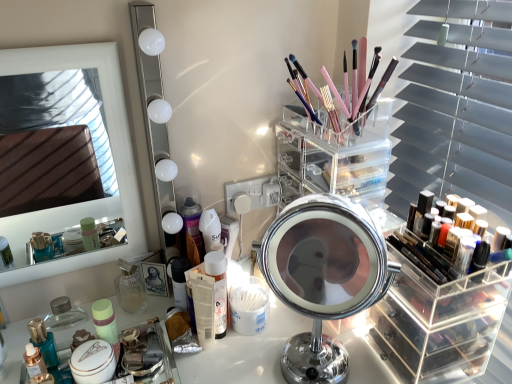
Question: Is clear acrylic organizer at center, acting as the 2th shelf starting from the bottom, in front of shiny metallic perfume at lower left, the 1th toiletry viewed from the left?

Choices:
 (A) yes
 (B) no

Answer: (A)

Question: Is clear acrylic organizer at center, marked as the 2th shelf in a right-to-left arrangement, at the left side of shiny metallic perfume at lower left, the 4th toiletry viewed from the right?

Choices:
 (A) no
 (B) yes

Answer: (A)

Question: From a real-world perspective, does clear acrylic organizer at center, acting as the 2th shelf starting from the bottom, stand above shiny metallic perfume at lower left, the 4th toiletry viewed from the right?

Choices:
 (A) no
 (B) yes

Answer: (B)

Question: Can shiny metallic perfume at lower left, the 4th toiletry viewed from the right, be found inside clear acrylic organizer at center, positioned as the 1th shelf in left-to-right order?

Choices:
 (A) no
 (B) yes

Answer: (A)

Question: Considering the relative sizes of clear acrylic organizer at center, positioned as the 1th shelf in left-to-right order, and shiny metallic perfume at lower left, the 4th toiletry viewed from the right, in the image provided, is clear acrylic organizer at center, positioned as the 1th shelf in left-to-right order, taller than shiny metallic perfume at lower left, the 4th toiletry viewed from the right,?

Choices:
 (A) yes
 (B) no

Answer: (A)

Question: Is clear acrylic organizer at center, placed as the first shelf when sorted from top to bottom, shorter than shiny metallic perfume at lower left, the 4th toiletry viewed from the right?

Choices:
 (A) no
 (B) yes

Answer: (A)

Question: Considering the relative positions of clear acrylic organizer at center, placed as the first shelf when sorted from top to bottom, and white glossy mirror at upper left, the second mirror viewed from the left, in the image provided, is clear acrylic organizer at center, placed as the first shelf when sorted from top to bottom, to the left of white glossy mirror at upper left, the second mirror viewed from the left, from the viewer's perspective?

Choices:
 (A) no
 (B) yes

Answer: (A)

Question: Considering the relative sizes of clear acrylic organizer at center, placed as the first shelf when sorted from top to bottom, and white glossy mirror at upper left, the second mirror viewed from the left, in the image provided, is clear acrylic organizer at center, placed as the first shelf when sorted from top to bottom, wider than white glossy mirror at upper left, the second mirror viewed from the left,?

Choices:
 (A) no
 (B) yes

Answer: (B)

Question: Does clear acrylic organizer at center, acting as the 2th shelf starting from the bottom, come in front of white glossy mirror at upper left, the second mirror viewed from the left?

Choices:
 (A) yes
 (B) no

Answer: (B)

Question: Is clear acrylic organizer at center, marked as the 2th shelf in a right-to-left arrangement, further to camera compared to white glossy mirror at upper left, the second mirror viewed from the left?

Choices:
 (A) yes
 (B) no

Answer: (A)

Question: Can you confirm if clear acrylic organizer at center, acting as the 2th shelf starting from the bottom, is shorter than white glossy mirror at upper left, the 2th mirror from the right?

Choices:
 (A) no
 (B) yes

Answer: (B)

Question: Does clear acrylic organizer at center, marked as the 2th shelf in a right-to-left arrangement, have a smaller size compared to white glossy mirror at upper left, the second mirror viewed from the left?

Choices:
 (A) yes
 (B) no

Answer: (B)

Question: Considering the relative sizes of shiny metallic perfume at lower left, the 4th toiletry viewed from the right, and clear acrylic organizer at center, marked as the 2th shelf in a right-to-left arrangement, in the image provided, is shiny metallic perfume at lower left, the 4th toiletry viewed from the right, bigger than clear acrylic organizer at center, marked as the 2th shelf in a right-to-left arrangement,?

Choices:
 (A) yes
 (B) no

Answer: (B)